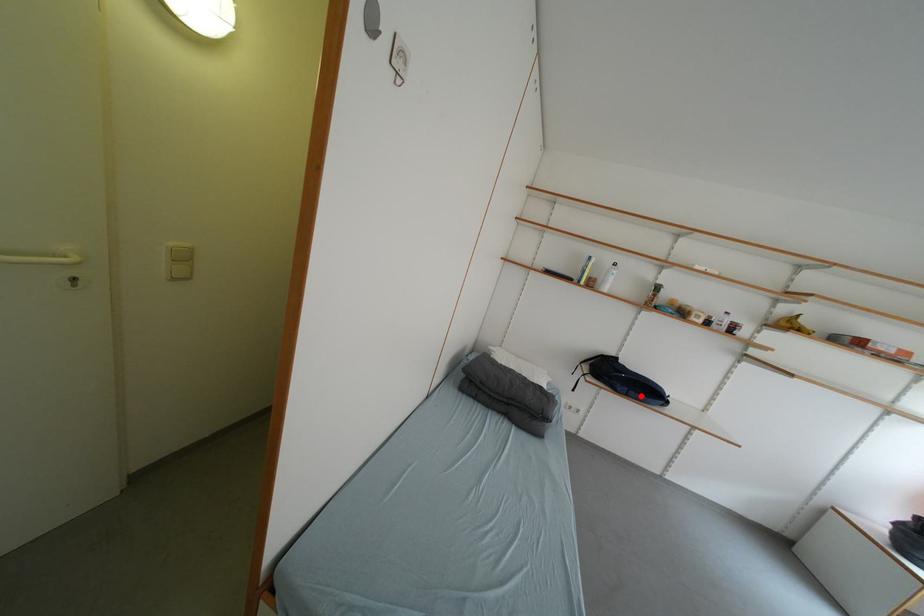
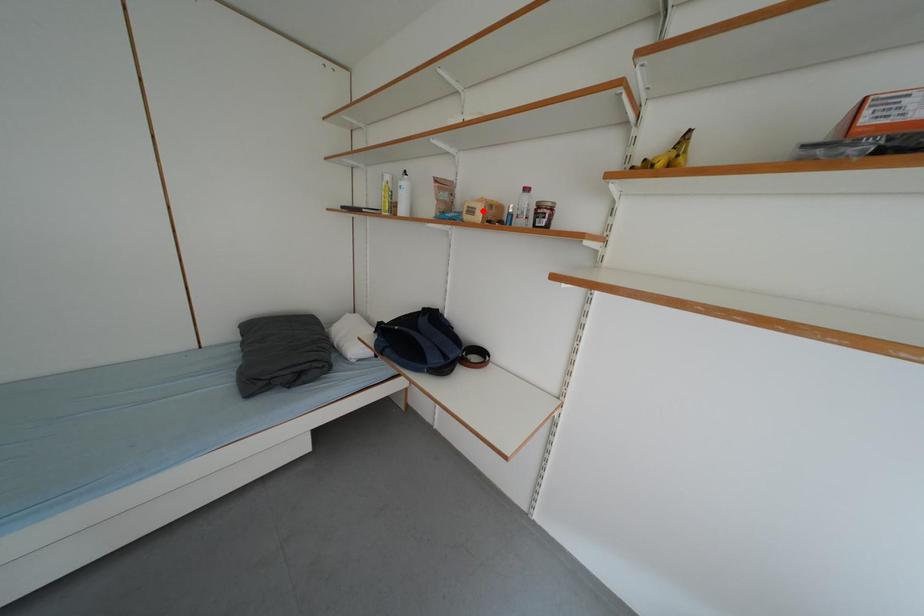
I am providing you with two images of the same scene from different viewpoints. A red point is marked on the first image and another point is marked on the second image. Is the marked point in image1 the same physical position as the marked point in image2?

No